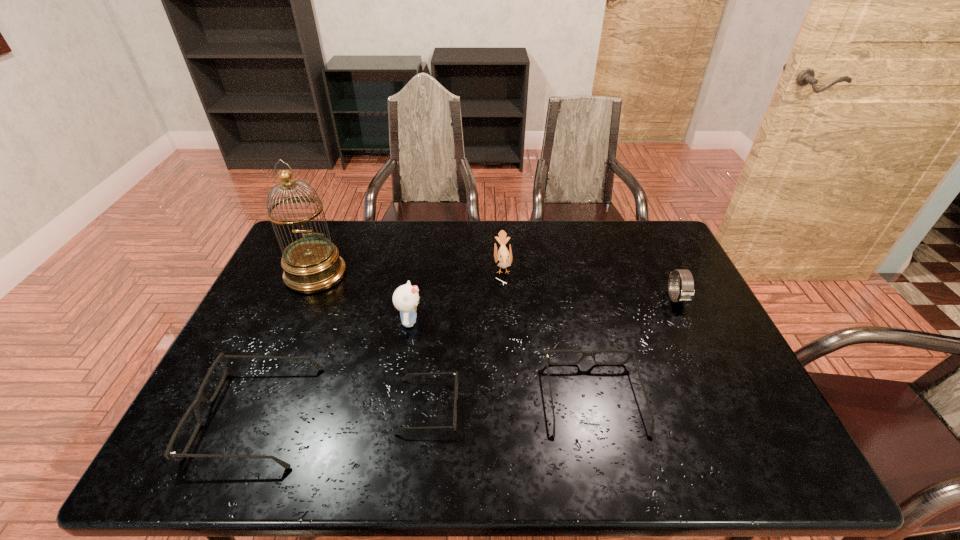
Where is `the leftmost spectacles`? the leftmost spectacles is located at coordinates (169, 454).

Identify the location of the shortest object. Image resolution: width=960 pixels, height=540 pixels. (456, 376).

The width and height of the screenshot is (960, 540). Find the location of `the shortest spectacles`. the shortest spectacles is located at coordinates click(456, 376).

Where is `the sixth tallest object`? The height and width of the screenshot is (540, 960). the sixth tallest object is located at coordinates pyautogui.click(x=631, y=354).

What are the coordinates of `the second tallest spectacles` in the screenshot? It's located at (631, 354).

At what (x,y) coordinates should I click in order to perform the action: click on the sixth shortest object. Please return your answer as a coordinate pair (x, y). The image size is (960, 540). Looking at the image, I should click on (406, 297).

Locate an element on the screen. the fourth nearest object is located at coordinates (406, 297).

The height and width of the screenshot is (540, 960). I want to click on the rightmost object, so click(686, 294).

The width and height of the screenshot is (960, 540). What are the coordinates of `bird` in the screenshot? It's located at (503, 258).

Identify the location of birdcage. The image size is (960, 540). (312, 264).